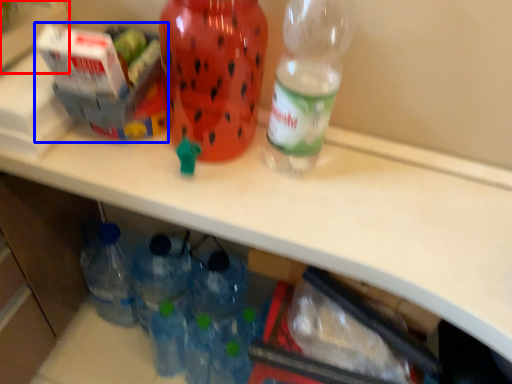
Question: Which point is further to the camera, box (highlighted by a red box) or box (highlighted by a blue box)?

Choices:
 (A) box
 (B) box

Answer: (B)